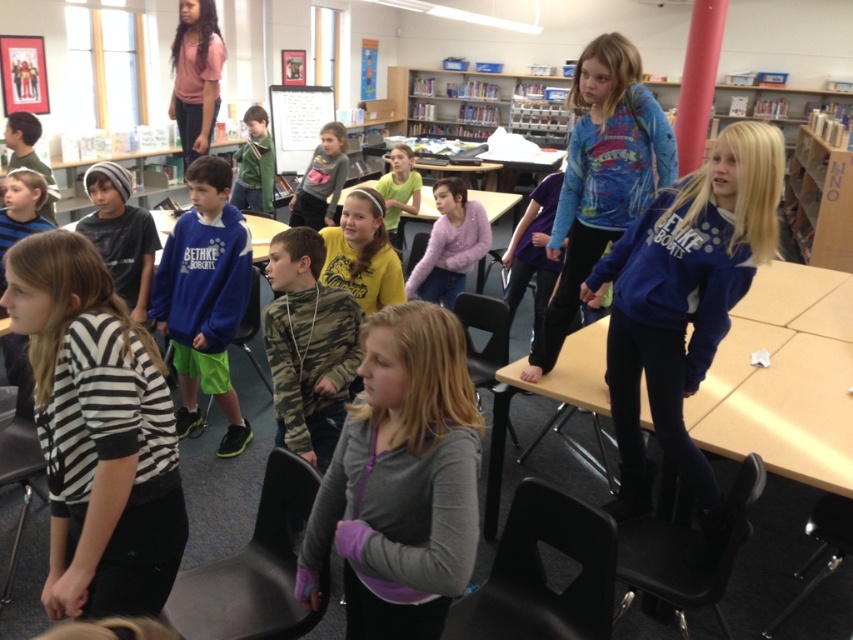
Who is taller, yellow matte shirt at center or pink t-shirt at upper left?

pink t-shirt at upper left is taller.

The height and width of the screenshot is (640, 853). What do you see at coordinates (363, 253) in the screenshot?
I see `yellow matte shirt at center` at bounding box center [363, 253].

Describe the element at coordinates (363, 253) in the screenshot. I see `yellow matte shirt at center` at that location.

The height and width of the screenshot is (640, 853). Find the location of `yellow matte shirt at center`. yellow matte shirt at center is located at coordinates (363, 253).

Is gray fleece jacket at center to the right of matte gray hoodie at center from the viewer's perspective?

Yes, gray fleece jacket at center is to the right of matte gray hoodie at center.

Is gray fleece jacket at center positioned before matte gray hoodie at center?

Yes, it is in front of matte gray hoodie at center.

Is point (410, 355) closer to camera compared to point (331, 168)?

Yes, point (410, 355) is closer to viewer.

You are a GUI agent. You are given a task and a screenshot of the screen. Output one action in this format:
    pyautogui.click(x=<x>, y=<y>)
    Task: Click on the gray fleece jacket at center
    Image resolution: width=853 pixels, height=640 pixels.
    Given the screenshot: What is the action you would take?
    pyautogui.click(x=401, y=481)

Between blue fleece jacket at upper center and green matte jacket at center, which one has less height?

Standing shorter between the two is green matte jacket at center.

Does blue fleece jacket at upper center have a lesser width compared to green matte jacket at center?

No, blue fleece jacket at upper center is not thinner than green matte jacket at center.

From the picture: Who is more forward, (637, 204) or (235, 152)?

Point (637, 204) is in front.

At what (x,y) coordinates should I click in order to perform the action: click on blue fleece jacket at upper center. Please return your answer as a coordinate pair (x, y). This screenshot has width=853, height=640. Looking at the image, I should click on (601, 177).